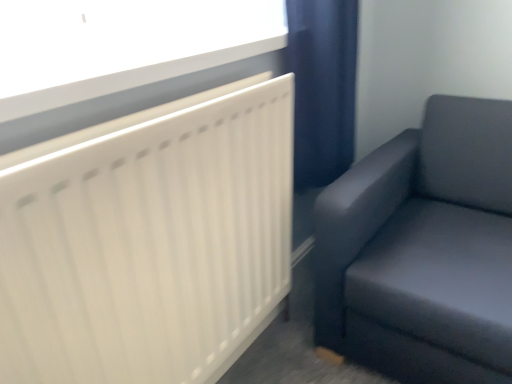
Question: Is white plastic window sill at upper left next to white matte radiator at upper left and touching it?

Choices:
 (A) no
 (B) yes

Answer: (A)

Question: Could white matte radiator at upper left be considered to be inside white plastic window sill at upper left?

Choices:
 (A) yes
 (B) no

Answer: (B)

Question: Is white plastic window sill at upper left at the left side of white matte radiator at upper left?

Choices:
 (A) no
 (B) yes

Answer: (B)

Question: Considering the relative positions of white plastic window sill at upper left and white matte radiator at upper left in the image provided, is white plastic window sill at upper left to the right of white matte radiator at upper left from the viewer's perspective?

Choices:
 (A) yes
 (B) no

Answer: (B)

Question: Would you consider white plastic window sill at upper left to be distant from white matte radiator at upper left?

Choices:
 (A) no
 (B) yes

Answer: (A)

Question: Is white plastic window sill at upper left wider than white matte radiator at upper left?

Choices:
 (A) no
 (B) yes

Answer: (B)

Question: Considering the relative positions of matte gray couch at right and white plastic window sill at upper left in the image provided, is matte gray couch at right to the left of white plastic window sill at upper left from the viewer's perspective?

Choices:
 (A) yes
 (B) no

Answer: (B)

Question: Does matte gray couch at right have a lesser width compared to white plastic window sill at upper left?

Choices:
 (A) yes
 (B) no

Answer: (B)

Question: From a real-world perspective, is matte gray couch at right under white plastic window sill at upper left?

Choices:
 (A) yes
 (B) no

Answer: (A)

Question: Considering the relative sizes of matte gray couch at right and white plastic window sill at upper left in the image provided, is matte gray couch at right bigger than white plastic window sill at upper left?

Choices:
 (A) yes
 (B) no

Answer: (A)

Question: Is matte gray couch at right in contact with white plastic window sill at upper left?

Choices:
 (A) yes
 (B) no

Answer: (B)

Question: Is matte gray couch at right behind white plastic window sill at upper left?

Choices:
 (A) yes
 (B) no

Answer: (A)

Question: From a real-world perspective, is white matte radiator at upper left over white plastic window sill at upper left?

Choices:
 (A) yes
 (B) no

Answer: (B)